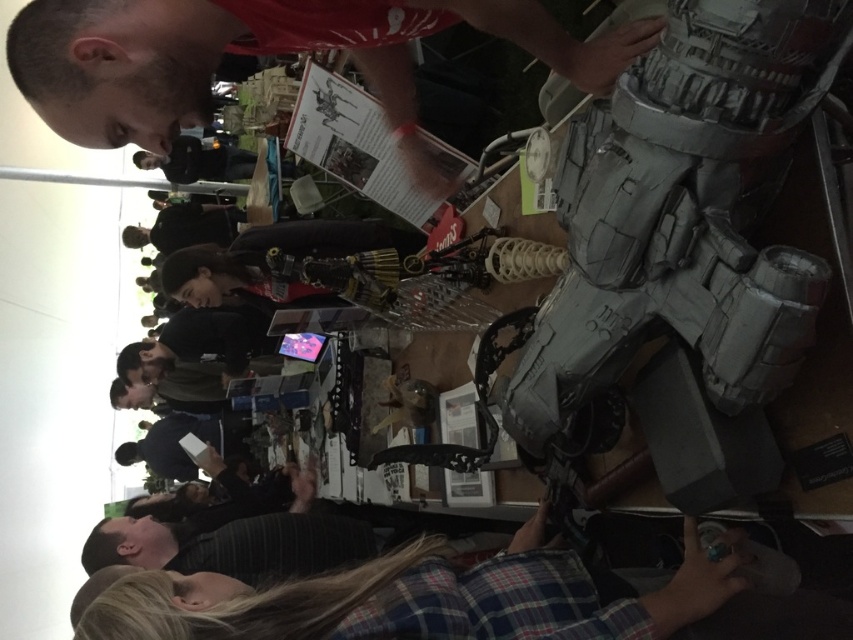
You are at an event and want to pick up the plaid fabric shirt at lower center without touching the matte gray helmet at upper right. Is this possible?

The matte gray helmet at upper right is located above the plaid fabric shirt at lower center, so you can reach down to pick up the plaid fabric shirt at lower center without touching the matte gray helmet at upper right.

You are at the center of the event and want to locate the matte gray helmet at upper right. According to the coordinates provided, in which direction should you look to find it?

The matte gray helmet at upper right is located at coordinates point (x=264, y=52), which is in the upper right direction from your current position at the center.